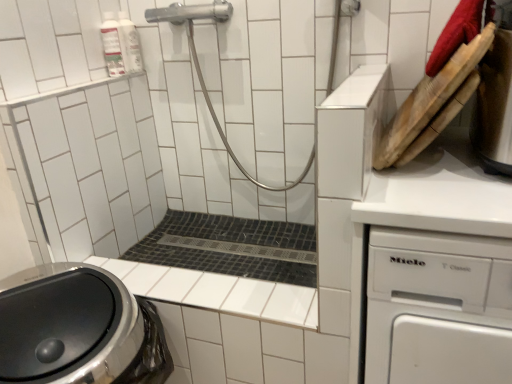
Question: In terms of height, does stainless steel kettle at upper right look taller or shorter compared to black mosaic tile bath at center?

Choices:
 (A) short
 (B) tall

Answer: (B)

Question: Considering the positions of stainless steel kettle at upper right and black mosaic tile bath at center in the image, is stainless steel kettle at upper right bigger or smaller than black mosaic tile bath at center?

Choices:
 (A) big
 (B) small

Answer: (B)

Question: Considering the real-world distances, which object is closest to the stainless steel washing machine at lower left?

Choices:
 (A) white plastic dishwasher at right
 (B) stainless steel kettle at upper right
 (C) black mosaic tile bath at center

Answer: (C)

Question: Based on their relative distances, which object is nearer to the stainless steel washing machine at lower left?

Choices:
 (A) white plastic dishwasher at right
 (B) stainless steel kettle at upper right
 (C) black mosaic tile bath at center

Answer: (C)